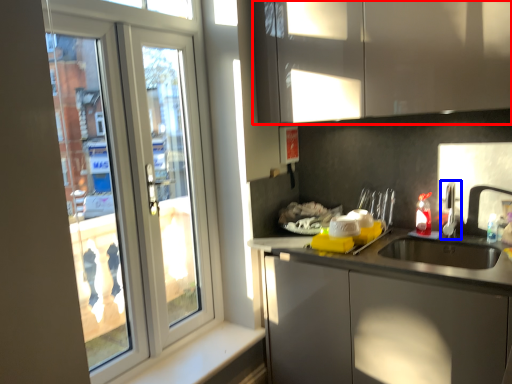
Question: Which object appears closest to the camera in this image, cabinetry (highlighted by a red box) or tap (highlighted by a blue box)?

Choices:
 (A) cabinetry
 (B) tap

Answer: (A)